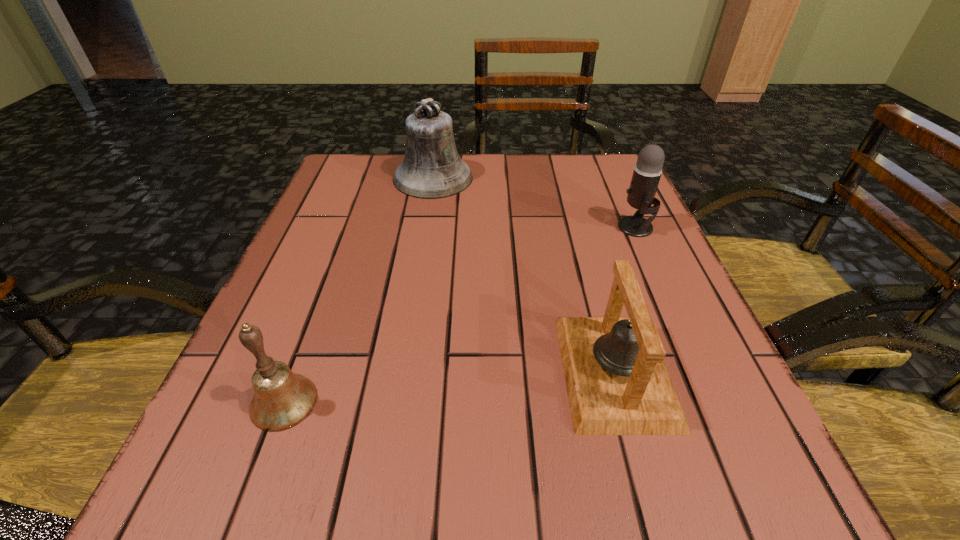
Find the location of `the third object from right to left`. the third object from right to left is located at coordinates (432, 168).

Locate an element on the screen. the tallest bell is located at coordinates (432, 168).

Locate an element on the screen. The image size is (960, 540). the third nearest object is located at coordinates (647, 171).

Locate an element on the screen. the rightmost object is located at coordinates (647, 171).

At what (x,y) coordinates should I click in order to perform the action: click on the leftmost bell. Please return your answer as a coordinate pair (x, y). Looking at the image, I should click on (282, 399).

The width and height of the screenshot is (960, 540). I want to click on the rightmost bell, so click(617, 383).

Find the location of a particular element. free space located on the right of the third object from right to left is located at coordinates (525, 178).

Find the location of `free space located on the left of the second farthest object`. free space located on the left of the second farthest object is located at coordinates (566, 227).

Locate an element on the screen. The width and height of the screenshot is (960, 540). free space located 0.050m on the front of the leftmost bell is located at coordinates (259, 469).

At what (x,y) coordinates should I click in order to perform the action: click on vacant space located on the left of the third object from left to right. Please return your answer as a coordinate pair (x, y). The height and width of the screenshot is (540, 960). Looking at the image, I should click on (444, 371).